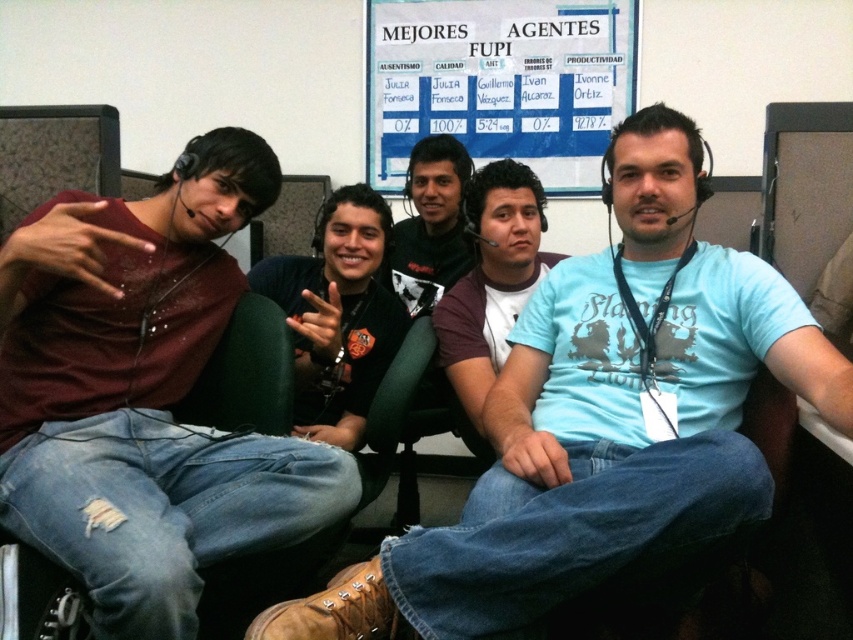
Question: Is matte maroon shirt at left wider than dark green t-shirt at center?

Choices:
 (A) no
 (B) yes

Answer: (B)

Question: Can you confirm if light blue t-shirt at center is smaller than white paper at upper center?

Choices:
 (A) yes
 (B) no

Answer: (B)

Question: Does light blue t-shirt at center appear under maroon fabric shirt at center?

Choices:
 (A) yes
 (B) no

Answer: (A)

Question: Which object is the closest to the light blue t-shirt at center?

Choices:
 (A) dark green t-shirt at center
 (B) white paper at upper center
 (C) maroon fabric shirt at center

Answer: (C)

Question: Which point is farther to the camera?

Choices:
 (A) (433, 44)
 (B) (537, 500)

Answer: (A)

Question: Considering the real-world distances, which object is farthest from the matte maroon shirt at left?

Choices:
 (A) dark green t-shirt at center
 (B) maroon fabric shirt at center
 (C) white paper at upper center

Answer: (C)